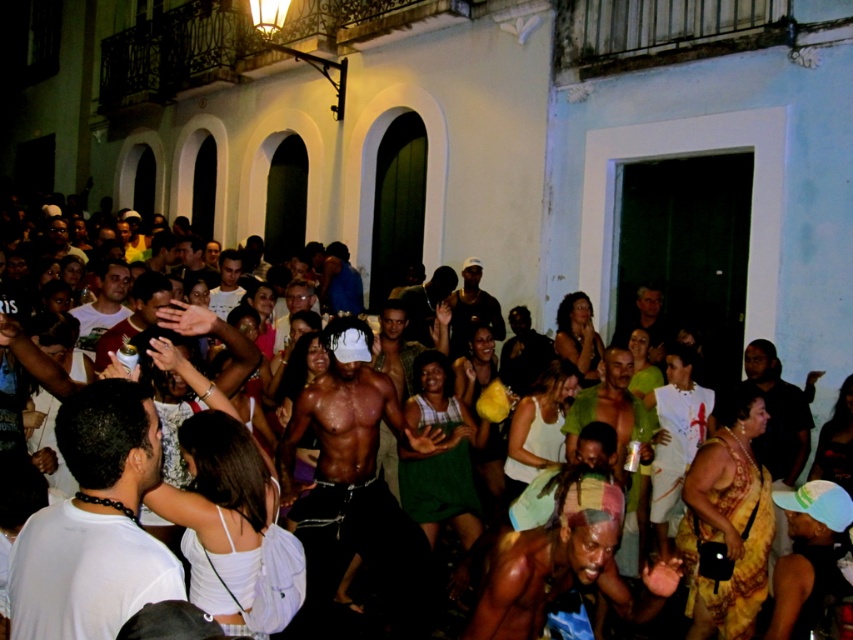
You are a GUI agent. You are given a task and a screenshot of the screen. Output one action in this format:
    pyautogui.click(x=<x>, y=<y>)
    Task: Click on the white matte t-shirt at lower left
    The height and width of the screenshot is (640, 853).
    Given the screenshot: What is the action you would take?
    pyautogui.click(x=96, y=524)

Which is above, white matte t-shirt at lower left or matte white shirt at center?

matte white shirt at center

Find the location of `white matte t-shirt at lower left`. white matte t-shirt at lower left is located at coordinates (96, 524).

In order to click on white matte t-shirt at lower left in this screenshot , I will do `click(96, 524)`.

Which is below, shiny black shirt at center or white matte shirt at center?

white matte shirt at center

Where is `shiny black shirt at center`? The image size is (853, 640). shiny black shirt at center is located at coordinates (9, 412).

Identify the location of shiny black shirt at center. (9, 412).

At what (x,y) coordinates should I click in order to perform the action: click on shiny black shirt at center. Please return your answer as a coordinate pair (x, y). Looking at the image, I should click on (9, 412).

Is shiny black skin at center positioned at the back of matte white shirt at center?

No, it is not.

In the scene shown: Does shiny black skin at center have a smaller size compared to matte white shirt at center?

No, shiny black skin at center is not smaller than matte white shirt at center.

Find the location of a particular element. The height and width of the screenshot is (640, 853). shiny black skin at center is located at coordinates (352, 486).